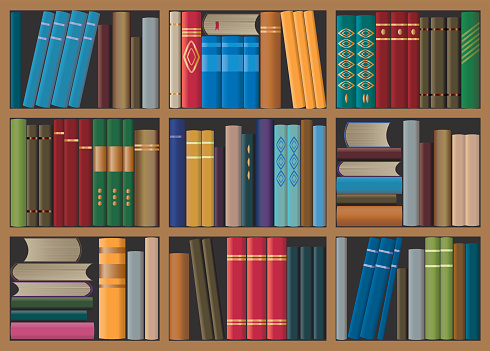
The image size is (490, 351). Identify the location of horizontally stacked books on middle shelf. (369, 132), (370, 152), (375, 167), (375, 182), (375, 199), (377, 216).